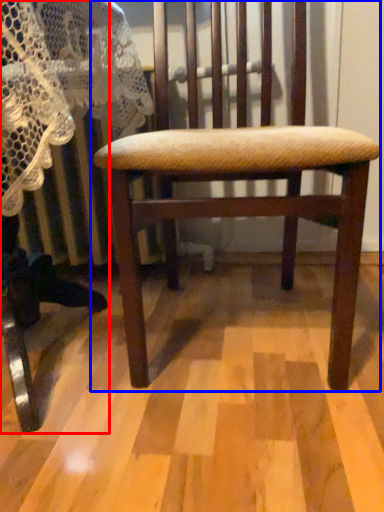
Question: Which object is closer to the camera taking this photo, rocking chair (highlighted by a red box) or chair (highlighted by a blue box)?

Choices:
 (A) rocking chair
 (B) chair

Answer: (A)